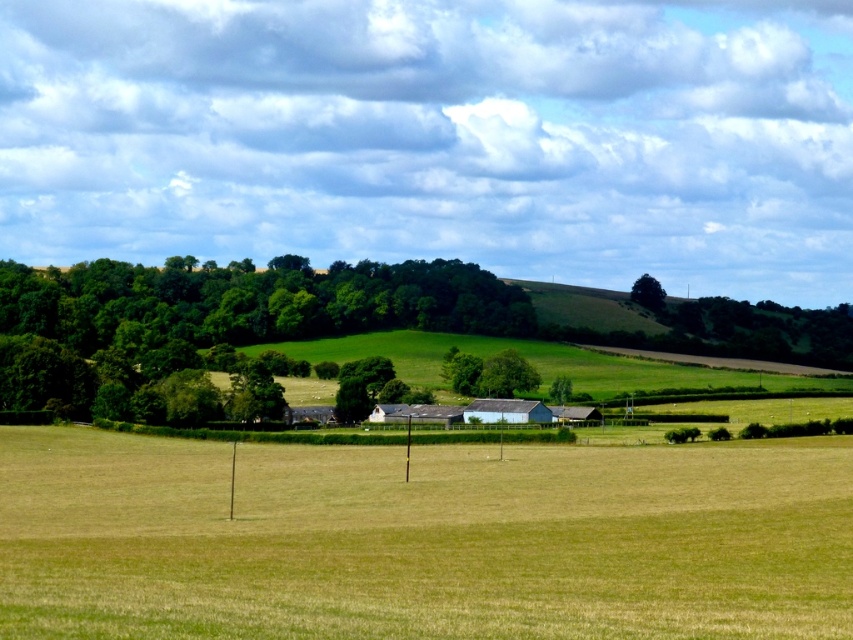
From the picture: Is green leafy tree at center bigger than green leafy tree at upper right?

Incorrect, green leafy tree at center is not larger than green leafy tree at upper right.

Is green leafy tree at center to the right of green leafy tree at upper right from the viewer's perspective?

No, green leafy tree at center is not to the right of green leafy tree at upper right.

This screenshot has width=853, height=640. What do you see at coordinates (360, 387) in the screenshot? I see `green leafy tree at center` at bounding box center [360, 387].

Find the location of a particular element. The image size is (853, 640). green leafy tree at center is located at coordinates (360, 387).

Is point (753, 508) in front of point (169, 314)?

That is True.

The image size is (853, 640). What are the coordinates of `green grass at center` in the screenshot? It's located at (421, 540).

Does point (277, 488) come behind point (39, 324)?

No, (277, 488) is in front of (39, 324).

Identify the location of green grass at center. The width and height of the screenshot is (853, 640). (421, 540).

Between point (312, 493) and point (368, 412), which one is positioned behind?

Positioned behind is point (368, 412).

Does green grass at center have a lesser width compared to green leafy tree at center?

In fact, green grass at center might be wider than green leafy tree at center.

Is point (94, 458) positioned before point (386, 358)?

Yes, it is.

I want to click on green grass at center, so click(421, 540).